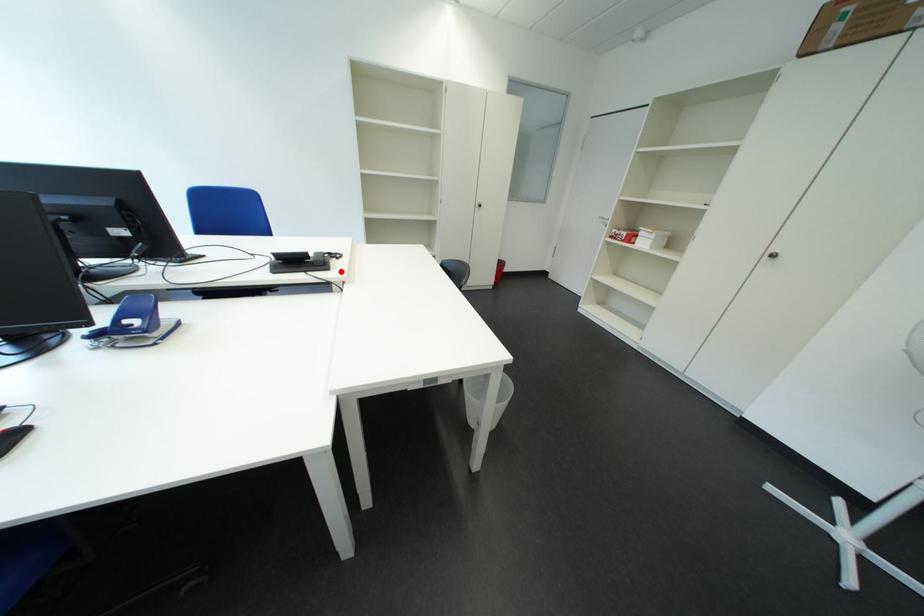
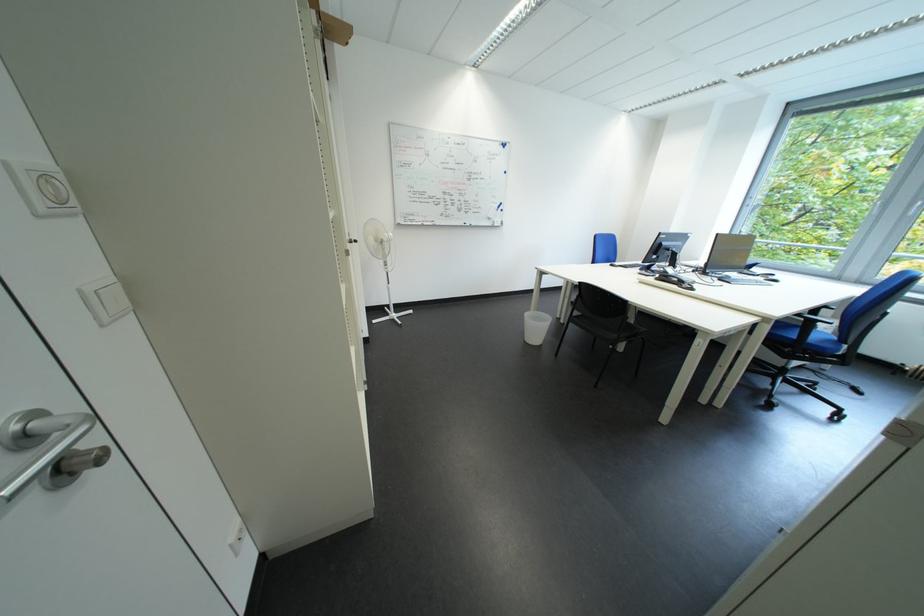
The point at the highlighted location is marked in the first image. Where is the corresponding point in the second image?

(669, 282)